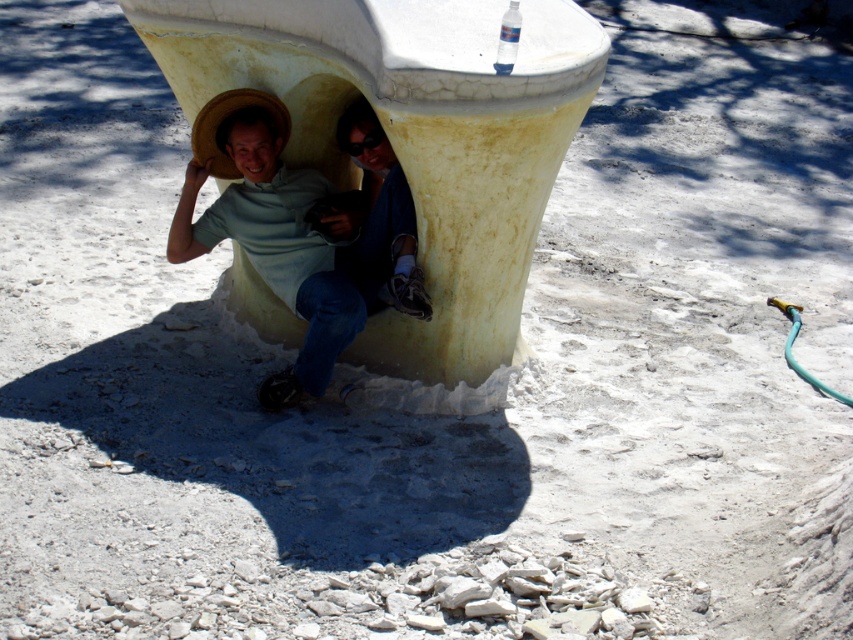
Question: Which point appears closest to the camera in this image?

Choices:
 (A) (202, 132)
 (B) (316, 10)
 (C) (376, 289)

Answer: (B)

Question: Considering the real-world distances, which object is closest to the matte blue jeans at center?

Choices:
 (A) matte straw hat at center
 (B) yellow cracked concrete pillar at center

Answer: (A)

Question: Which object appears farthest from the camera in this image?

Choices:
 (A) matte straw hat at center
 (B) yellow cracked concrete pillar at center
 (C) matte blue jeans at center

Answer: (C)

Question: Is matte straw hat at center further to the viewer compared to matte blue jeans at center?

Choices:
 (A) no
 (B) yes

Answer: (A)

Question: Is matte straw hat at center closer to camera compared to matte blue jeans at center?

Choices:
 (A) no
 (B) yes

Answer: (B)

Question: Can you confirm if matte straw hat at center is bigger than matte blue jeans at center?

Choices:
 (A) yes
 (B) no

Answer: (A)